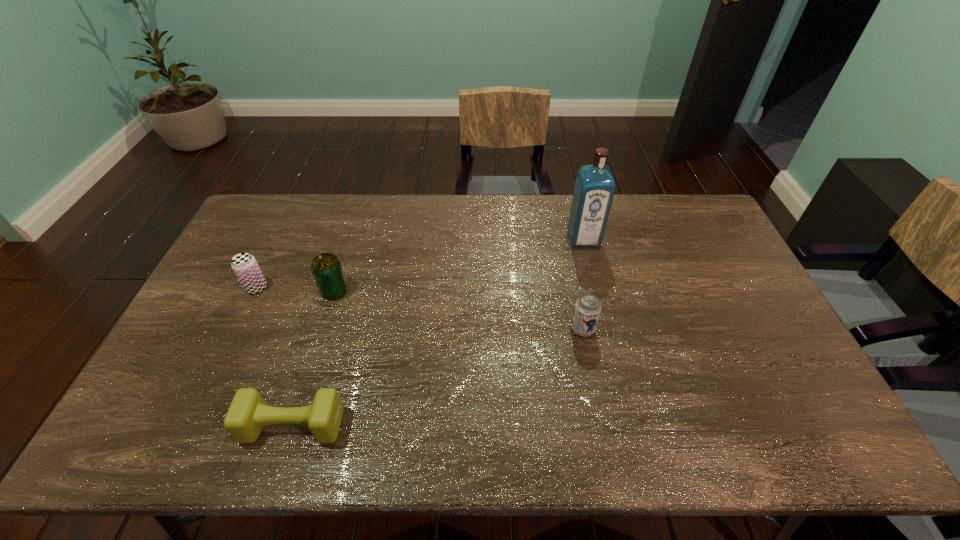
At what (x,y) coordinates should I click in order to perform the action: click on vacant space at the far right corner. Please return your answer as a coordinate pair (x, y). Looking at the image, I should click on (669, 206).

Identify the location of vacant area that lies between the second beer can from right to left and the nearest beer can. (459, 310).

You are a GUI agent. You are given a task and a screenshot of the screen. Output one action in this format:
    pyautogui.click(x=<x>, y=<y>)
    Task: Click on the vacant region between the leftmost object and the second beer can from left to right
    
    Given the screenshot: What is the action you would take?
    pyautogui.click(x=296, y=289)

Identify the location of vacant space in between the leftmost object and the farthest object. (420, 263).

What are the coordinates of `free space between the leftmost object and the dumbbell` in the screenshot? It's located at (275, 356).

Locate an element on the screen. This screenshot has width=960, height=540. vacant space in between the second nearest object and the second beer can from left to right is located at coordinates (459, 310).

The width and height of the screenshot is (960, 540). What are the coordinates of `vacant space that's between the nearest object and the second nearest object` in the screenshot? It's located at (438, 377).

The width and height of the screenshot is (960, 540). Identify the location of free space between the farthest object and the fourth farthest object. (583, 284).

Find the location of a particular element. The image size is (960, 540). vacant point located between the tallest object and the second beer can from left to right is located at coordinates (459, 265).

The height and width of the screenshot is (540, 960). I want to click on vacant area that lies between the farthest object and the shortest object, so click(439, 332).